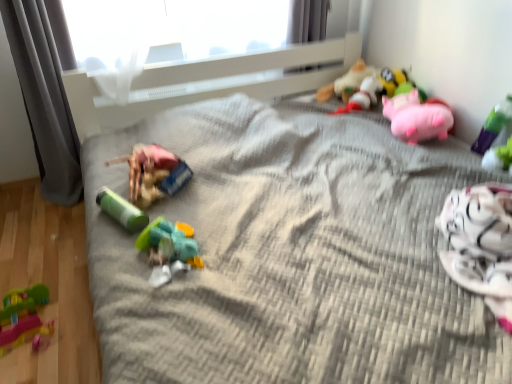
Question: Is green plastic toy at upper right, arranged as the 1th toy when viewed from the right, in front of or behind pink plush pig at upper right, placed as the 5th toy when sorted from left to right, in the image?

Choices:
 (A) behind
 (B) front

Answer: (B)

Question: Is green plastic toy at upper right, marked as the 7th toy in a left-to-right arrangement, bigger or smaller than pink plush pig at upper right, placed as the 5th toy when sorted from left to right?

Choices:
 (A) small
 (B) big

Answer: (A)

Question: Estimate the real-world distances between objects in this image. Which object is closer to the green plastic toy at upper right, marked as the 7th toy in a left-to-right arrangement?

Choices:
 (A) pink plush pig at upper right, which is the third toy in right-to-left order
 (B) green plastic toy at center-left, which is counted as the 2th toy, starting from the left
 (C) gray fabric curtain at left, which appears as the 2th curtain when viewed from the right
 (D) soft plush toy at upper right, the fourth toy when ordered from right to left
 (E) rubber duck at center, acting as the third toy starting from the left

Answer: (A)

Question: Estimate the real-world distances between objects in this image. Which object is closer to the rubberized green and pink toy at lower left, which appears as the 7th toy when viewed from the right?

Choices:
 (A) rubber duck at center, the fifth toy viewed from the right
 (B) green plastic toy at center-left, acting as the 6th toy starting from the right
 (C) green plastic toy at upper right, marked as the 7th toy in a left-to-right arrangement
 (D) pink plush pig at upper right, which is the third toy in right-to-left order
 (E) soft plush bee at upper right, arranged as the 6th toy when viewed from the left

Answer: (B)